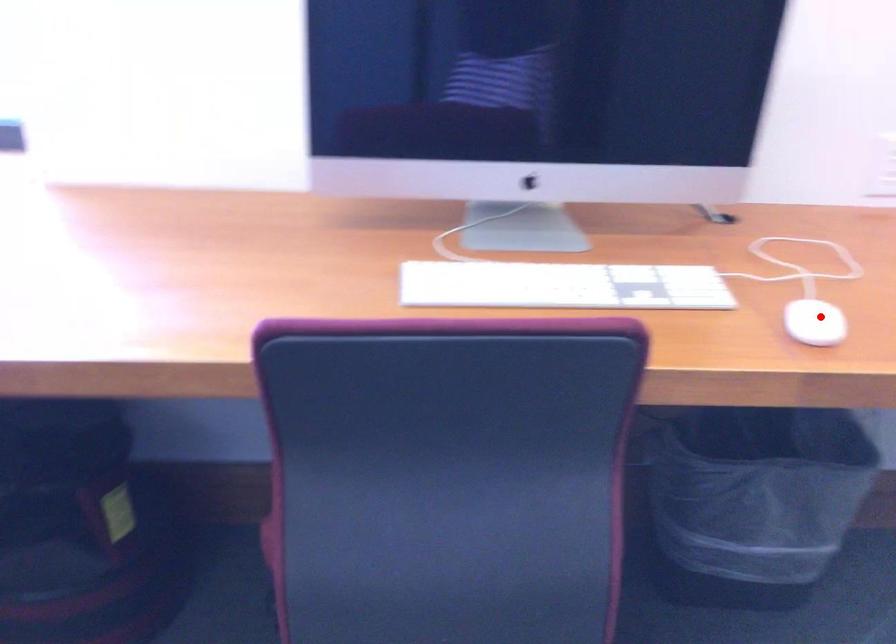
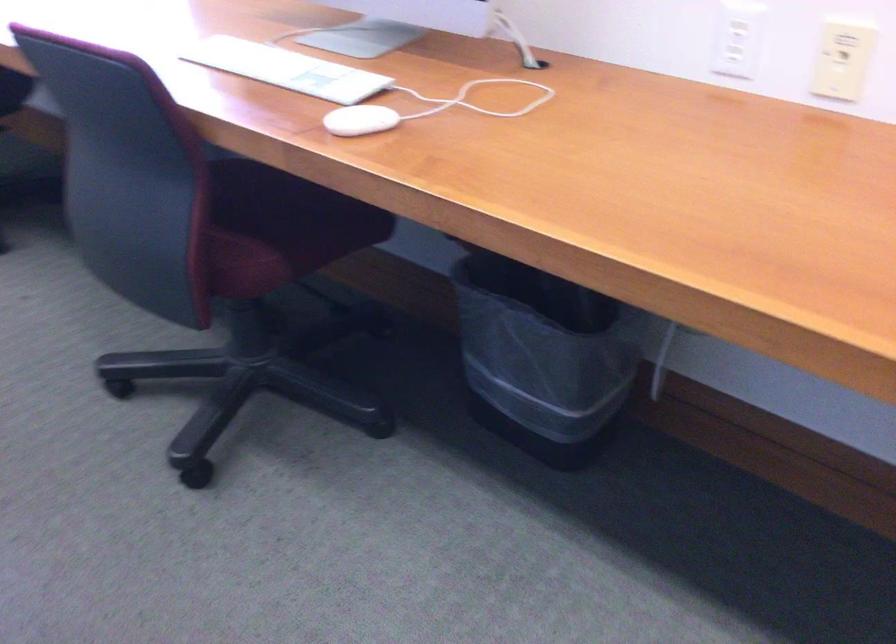
Question: I am providing you with two images of the same scene from different viewpoints. Image1 has a red point marked. In image2, the corresponding 3D location appears at what relative position? Reply with the corresponding letter.

Choices:
 (A) Closer
 (B) Farther

Answer: (B)